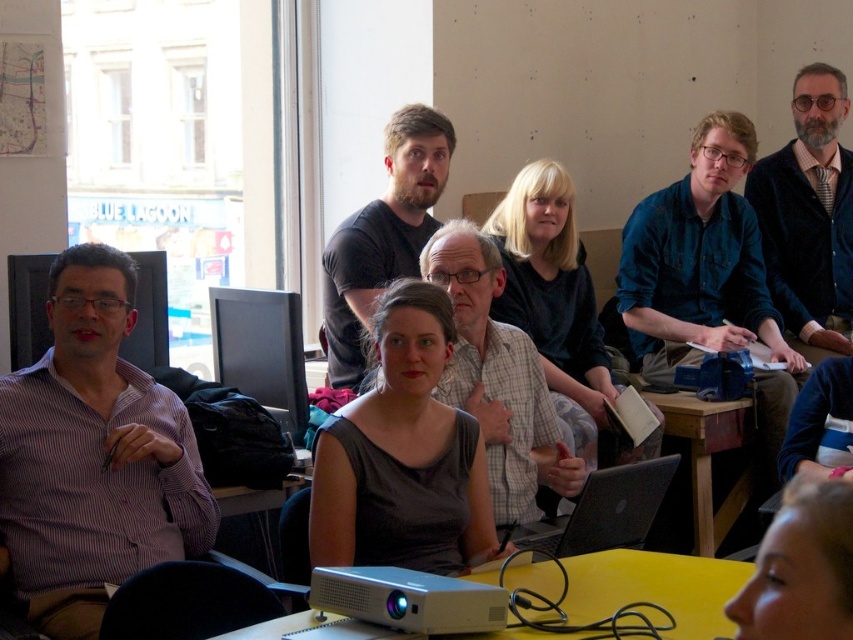
Who is positioned more to the left, silver metallic laptop at lower center or wooden table at lower center?

silver metallic laptop at lower center

Which of these two, silver metallic laptop at lower center or wooden table at lower center, stands taller?

wooden table at lower center is taller.

Locate an element on the screen. silver metallic laptop at lower center is located at coordinates (604, 512).

Between matte black shirt at center and matte black monitor at center, which one appears on the left side from the viewer's perspective?

matte black monitor at center

Does point (598, 445) come closer to viewer compared to point (260, 403)?

No.

At what (x,y) coordinates should I click in order to perform the action: click on matte black shirt at center. Please return your answer as a coordinate pair (x, y). Image resolution: width=853 pixels, height=640 pixels. Looking at the image, I should click on pyautogui.click(x=558, y=307).

Locate an element on the screen. The width and height of the screenshot is (853, 640). purple striped shirt at left is located at coordinates (93, 456).

Which is behind, point (73, 492) or point (828, 148)?

The point (828, 148) is more distant.

You are a GUI agent. You are given a task and a screenshot of the screen. Output one action in this format:
    pyautogui.click(x=<x>, y=<y>)
    Task: Click on the purple striped shirt at left
    
    Given the screenshot: What is the action you would take?
    pyautogui.click(x=93, y=456)